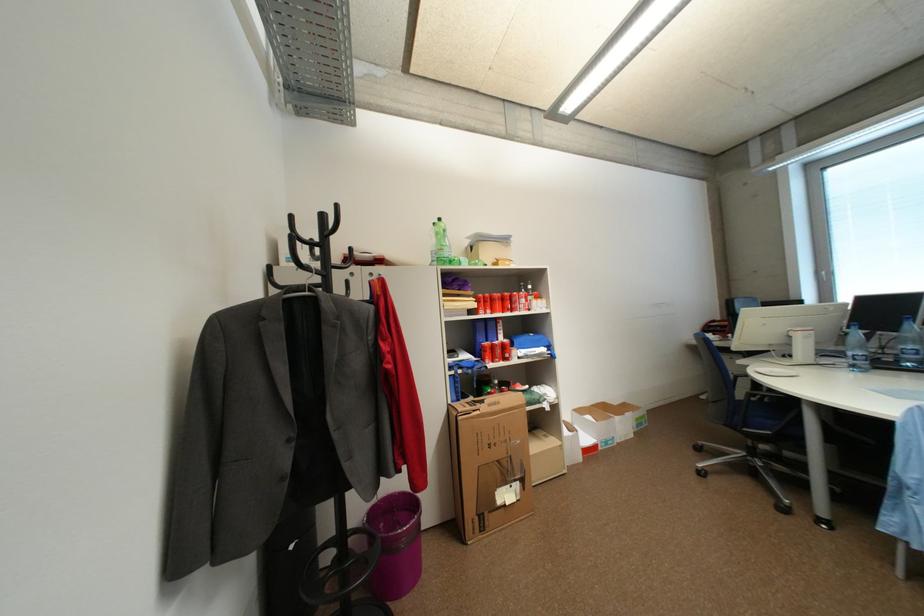
Find the location of a particular element. This screenshot has width=924, height=616. blue chair armrest is located at coordinates (764, 394).